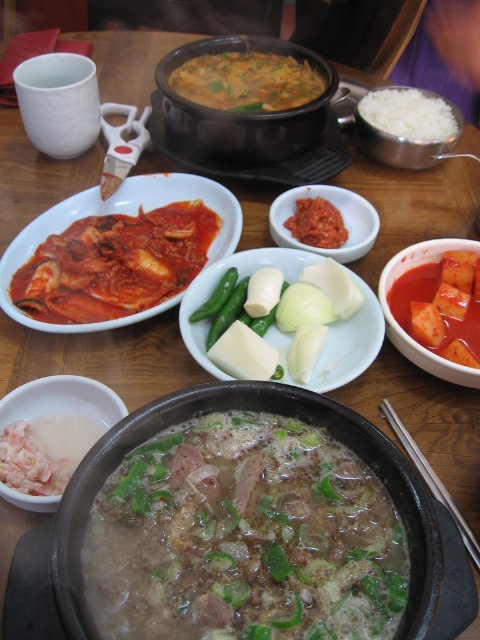
Question: Considering the relative positions of white creamy soup at lower left and white metallic rice at upper right in the image provided, where is white creamy soup at lower left located with respect to white metallic rice at upper right?

Choices:
 (A) above
 (B) below

Answer: (B)

Question: Estimate the real-world distances between objects in this image. Which object is closer to the matte ceramic pot at center?

Choices:
 (A) tomato sauce pasta at center
 (B) smooth white bowl at center

Answer: (B)

Question: Is matte ceramic pot at center to the left of bright red paste at center from the viewer's perspective?

Choices:
 (A) yes
 (B) no

Answer: (A)

Question: Is red matte kimchi at center smaller than white metallic rice at upper right?

Choices:
 (A) no
 (B) yes

Answer: (B)

Question: Which of these objects is positioned farthest from the slightly browned broth at center?

Choices:
 (A) smooth white bowl at center
 (B) matte ceramic pot at center
 (C) white creamy soup at lower left
 (D) white metallic rice at upper right

Answer: (D)

Question: Which point is farther to the camera?

Choices:
 (A) white metallic rice at upper right
 (B) smooth white bowl at center
 (C) white shredded meat at lower left
 (D) white creamy soup at lower left

Answer: (A)